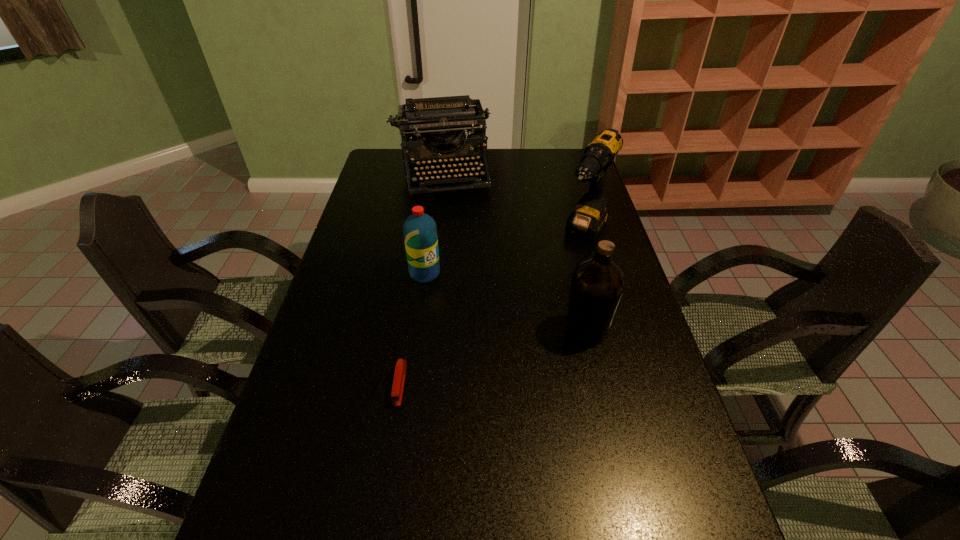
Where is `stapler`? stapler is located at coordinates pyautogui.click(x=400, y=370).

Find the location of a particular element. the nearest object is located at coordinates (400, 370).

Image resolution: width=960 pixels, height=540 pixels. I want to click on the fourth farthest object, so click(597, 284).

Locate an element on the screen. The height and width of the screenshot is (540, 960). the third farthest object is located at coordinates (420, 232).

Locate an element on the screen. The image size is (960, 540). the second farthest object is located at coordinates (585, 222).

Identify the location of the farthest object. The height and width of the screenshot is (540, 960). (429, 121).

The height and width of the screenshot is (540, 960). Find the location of `free space located on the front-facing side of the nearest object`. free space located on the front-facing side of the nearest object is located at coordinates (380, 513).

You are a GUI agent. You are given a task and a screenshot of the screen. Output one action in this format:
    pyautogui.click(x=<x>, y=<y>)
    Task: Click on the vacant space located 0.080m on the label of the olive oil
    
    Given the screenshot: What is the action you would take?
    pyautogui.click(x=639, y=330)

Where is `free location located 0.280m on the front label of the third nearest object`? free location located 0.280m on the front label of the third nearest object is located at coordinates (471, 349).

I want to click on free space located 0.160m on the front label of the third nearest object, so tap(453, 318).